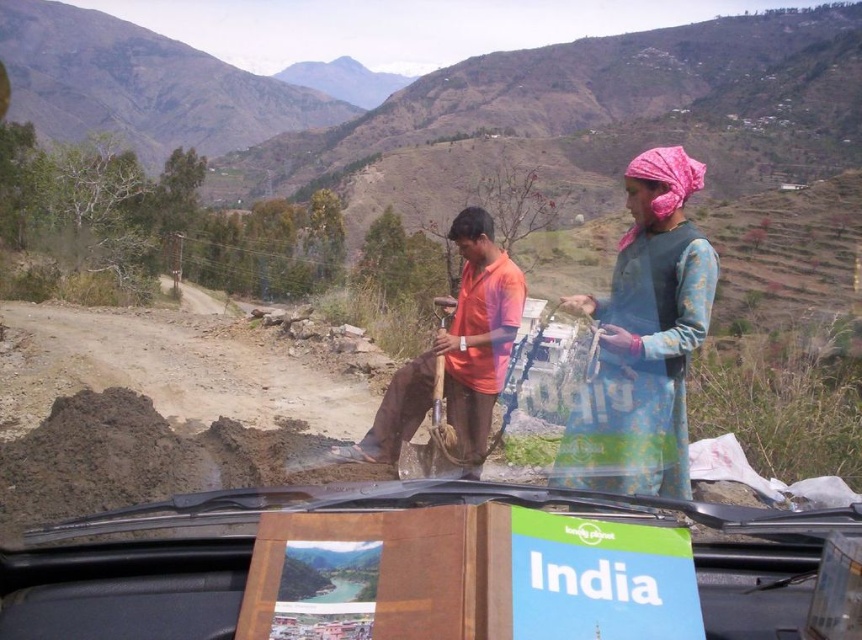
Question: Among these points, which one is nearest to the camera?

Choices:
 (A) (644, 164)
 (B) (182, 435)
 (C) (628, 388)
 (D) (490, 230)

Answer: (C)

Question: Can you confirm if blue printed dress at right is bigger than orange cotton shirt at center?

Choices:
 (A) no
 (B) yes

Answer: (A)

Question: Which point is closer to the camera taking this photo?

Choices:
 (A) tap(116, 458)
 (B) tap(676, 163)
 (C) tap(472, 362)

Answer: (B)

Question: Among these points, which one is farthest from the camera?

Choices:
 (A) (697, 337)
 (B) (128, 388)
 (C) (458, 228)
 (D) (682, 148)

Answer: (B)

Question: Can you confirm if orange cotton shirt at center is wider than pink fabric headscarf at upper right?

Choices:
 (A) no
 (B) yes

Answer: (A)

Question: Is blue printed dress at right positioned before pink fabric headscarf at upper right?

Choices:
 (A) no
 (B) yes

Answer: (B)